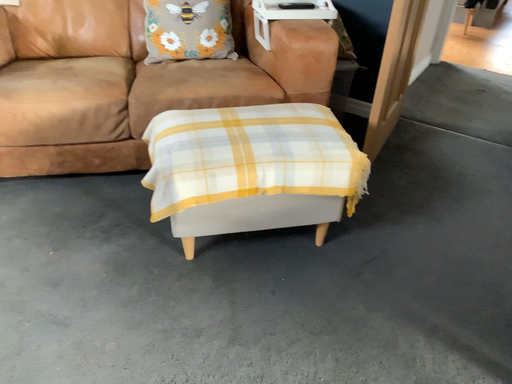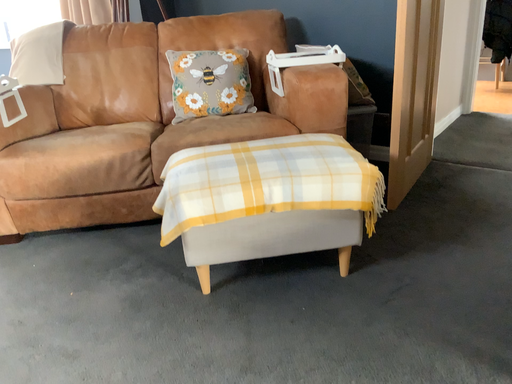
Question: Which way did the camera rotate in the video?

Choices:
 (A) rotated downward
 (B) rotated upward

Answer: (B)